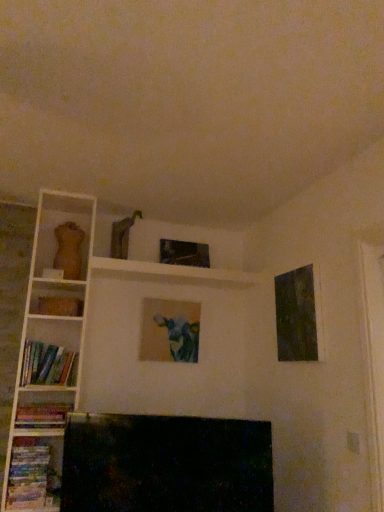
Question: Is hardcover book at left positioned before matte canvas painting at center, the 2th picture frame from the back?

Choices:
 (A) no
 (B) yes

Answer: (B)

Question: Can you confirm if hardcover book at left is taller than matte canvas painting at center, the 2th picture frame from the back?

Choices:
 (A) no
 (B) yes

Answer: (A)

Question: From a real-world perspective, is hardcover book at left located higher than matte canvas painting at center, which appears as the 2th picture frame when viewed from the front?

Choices:
 (A) no
 (B) yes

Answer: (B)

Question: Would you consider hardcover book at left to be distant from matte canvas painting at center, the 2th picture frame from the back?

Choices:
 (A) yes
 (B) no

Answer: (B)

Question: Considering the relative positions of hardcover book at left and matte canvas painting at center, which appears as the 2th picture frame when viewed from the front, in the image provided, is hardcover book at left to the left of matte canvas painting at center, which appears as the 2th picture frame when viewed from the front, from the viewer's perspective?

Choices:
 (A) yes
 (B) no

Answer: (A)

Question: Is hardcover book at left wider than matte canvas painting at center, the 2th picture frame from the back?

Choices:
 (A) yes
 (B) no

Answer: (A)

Question: Is metallic glass picture frame at upper center, which ranks as the second picture frame in right-to-left order, facing towards hardcover books at lower left, the first book from the bottom?

Choices:
 (A) yes
 (B) no

Answer: (B)

Question: Does metallic glass picture frame at upper center, which ranks as the second picture frame in right-to-left order, appear on the right side of hardcover books at lower left, which appears as the third book when viewed from the top?

Choices:
 (A) no
 (B) yes

Answer: (B)

Question: Is metallic glass picture frame at upper center, the third picture frame positioned from the front, thinner than hardcover books at lower left, the first book from the bottom?

Choices:
 (A) yes
 (B) no

Answer: (A)

Question: From a real-world perspective, is metallic glass picture frame at upper center, which ranks as the second picture frame in right-to-left order, physically above hardcover books at lower left, the first book from the bottom?

Choices:
 (A) yes
 (B) no

Answer: (A)

Question: From a real-world perspective, is metallic glass picture frame at upper center, which ranks as the second picture frame in right-to-left order, located beneath hardcover books at lower left, the first book from the bottom?

Choices:
 (A) yes
 (B) no

Answer: (B)

Question: Is hardcover books at lower left, which appears as the third book when viewed from the top, surrounded by metallic glass picture frame at upper center, the third picture frame positioned from the front?

Choices:
 (A) no
 (B) yes

Answer: (A)

Question: From the image's perspective, is dark textured canvas at upper right, the first picture frame when ordered from front to back, located beneath matte canvas painting at center, the 2th picture frame from the back?

Choices:
 (A) yes
 (B) no

Answer: (B)